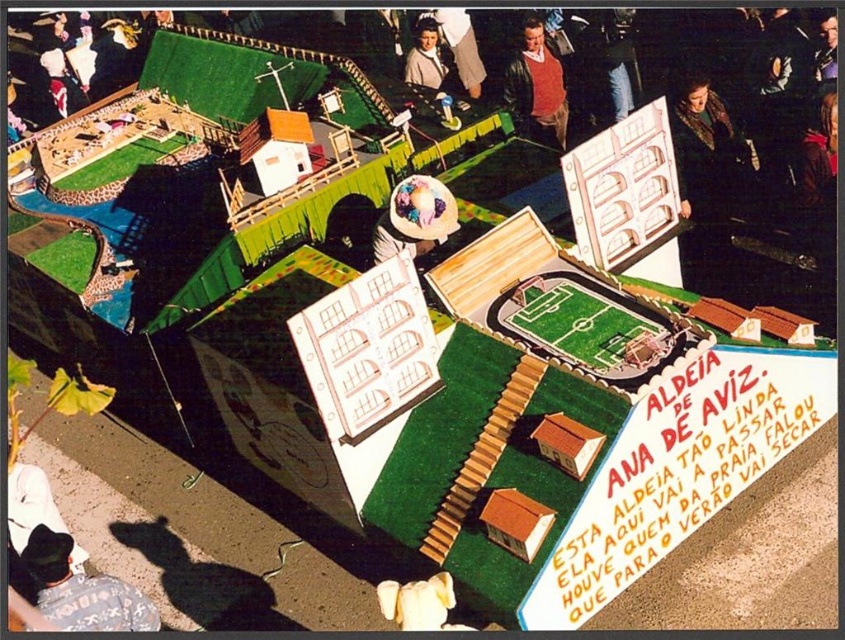
You are a visitor to the miniature diorama and notice the black cotton shirt at lower left and the matte brown leather jacket at upper center. Which of these two items is positioned closer to the bottom of the image?

The black cotton shirt at lower left is positioned closer to the bottom of the image because it is located below the matte brown leather jacket at upper center.

Based on the scene description, what object is located at the coordinates point (x=82, y=589)?

The black cotton shirt at lower left is located at point (x=82, y=589).

You are a visitor to this miniature village and notice two items at the upper center area. Which one is closer to you, the leather jacket at upper center or the matte white hat at upper center?

The leather jacket at upper center is closer to the viewer than the matte white hat at upper center.